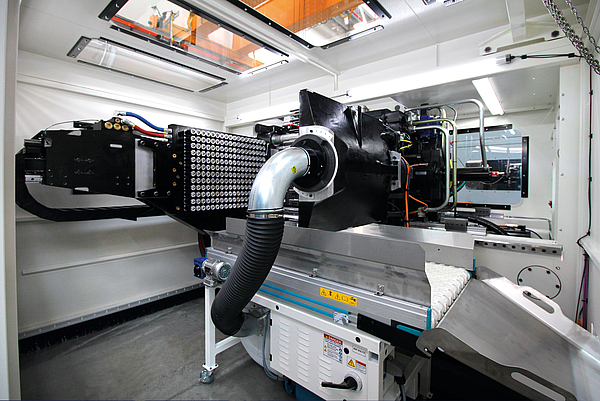
Identify the location of floor. This screenshot has height=401, width=600. (127, 352).